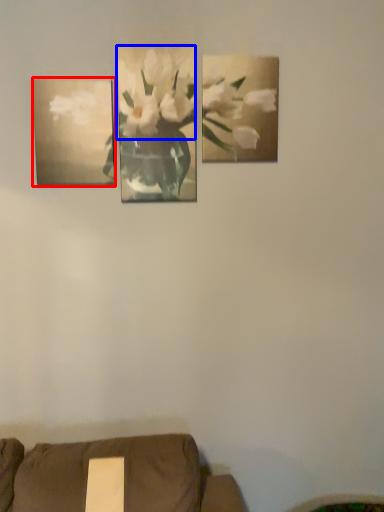
Question: Which point is further to the camera, picture frame (highlighted by a red box) or flower (highlighted by a blue box)?

Choices:
 (A) picture frame
 (B) flower

Answer: (B)